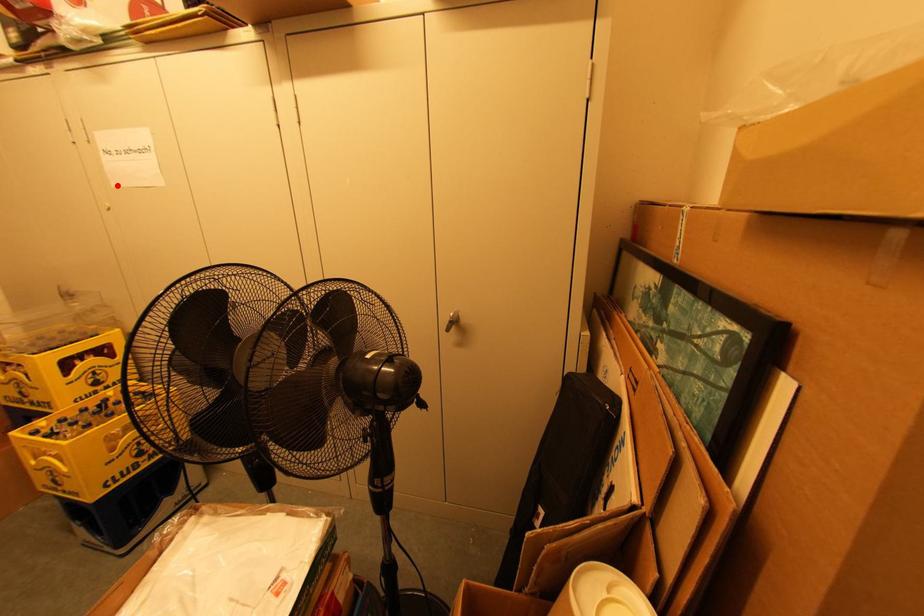
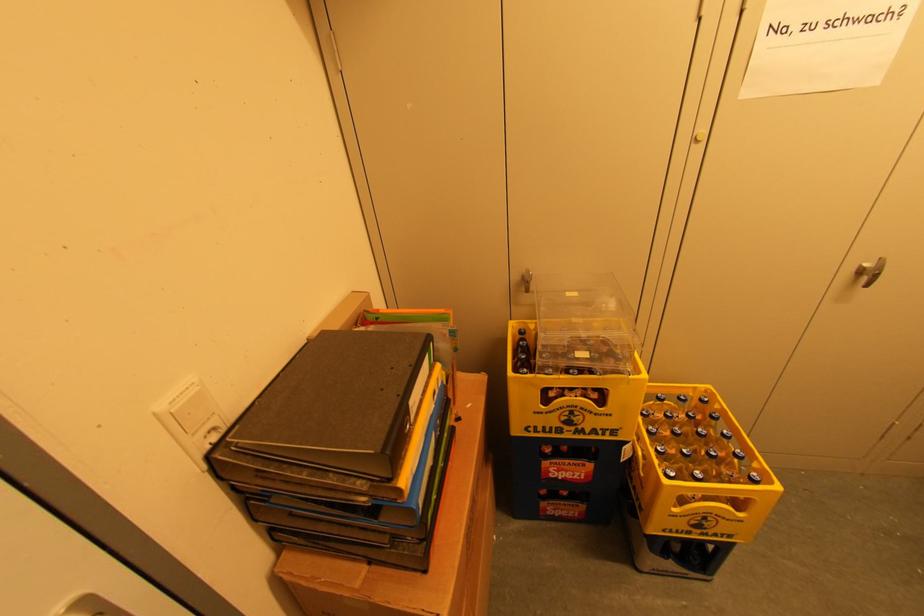
In the second image, find the point that corresponds to the highlighted location in the first image.

(748, 92)